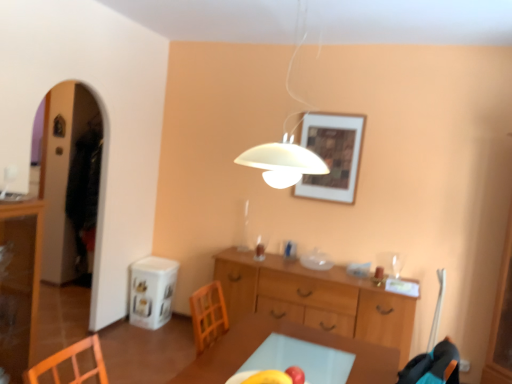
The height and width of the screenshot is (384, 512). What are the coordinates of `white matte lampshade at upper center` in the screenshot? It's located at (287, 135).

Measure the distance between point (323,145) and camera.

The depth of point (323,145) is 3.60 meters.

The width and height of the screenshot is (512, 384). What do you see at coordinates (332, 155) in the screenshot? I see `wooden framed artwork at upper center` at bounding box center [332, 155].

What is the approximate width of yellow matte apple at center?

It is 6.51 inches.

The image size is (512, 384). Describe the element at coordinates (315, 299) in the screenshot. I see `wooden cabinet at center` at that location.

Locate an element on the screen. The width and height of the screenshot is (512, 384). white matte lampshade at upper center is located at coordinates (287, 135).

Between white matte lampshade at upper center and light brown wooden table at center, which one has smaller size?

With smaller size is white matte lampshade at upper center.

Between white matte lampshade at upper center and light brown wooden table at center, which one appears on the left side from the viewer's perspective?

white matte lampshade at upper center is more to the left.

Measure the distance between white matte lampshade at upper center and light brown wooden table at center.

A distance of 6.52 feet exists between white matte lampshade at upper center and light brown wooden table at center.

Can you tell me how much white matte lampshade at upper center and light brown wooden table at center differ in facing direction?

white matte lampshade at upper center and light brown wooden table at center are facing 1.98 degrees away from each other.

Consider the image. Considering the positions of objects white matte lampshade at upper center and yellow matte apple at center in the image provided, who is behind, white matte lampshade at upper center or yellow matte apple at center?

yellow matte apple at center is more distant.

In the image, is white matte lampshade at upper center on the left side or the right side of yellow matte apple at center?

In the image, white matte lampshade at upper center appears on the right side of yellow matte apple at center.

Considering the sizes of objects white matte lampshade at upper center and yellow matte apple at center in the image provided, who is wider, white matte lampshade at upper center or yellow matte apple at center?

white matte lampshade at upper center is wider.

How different are the orientations of white matte lampshade at upper center and yellow matte apple at center in degrees?

The facing directions of white matte lampshade at upper center and yellow matte apple at center are 6.13e-05 degrees apart.

From a real-world perspective, is transparent glass cabinet at left positioned under wooden framed artwork at upper center based on gravity?

Yes, from a real-world perspective, transparent glass cabinet at left is below wooden framed artwork at upper center.

Is wooden framed artwork at upper center a part of transparent glass cabinet at left?

No, wooden framed artwork at upper center is not inside transparent glass cabinet at left.

Visually, is transparent glass cabinet at left positioned to the left or to the right of wooden framed artwork at upper center?

transparent glass cabinet at left is positioned on wooden framed artwork at upper center's left side.

Is transparent glass cabinet at left next to wooden framed artwork at upper center and touching it?

No, transparent glass cabinet at left is not beside wooden framed artwork at upper center.

Which of these two, wooden cabinet at center or yellow matte apple at center, is wider?

Wider between the two is wooden cabinet at center.

In the image, is wooden cabinet at center positioned in front of or behind yellow matte apple at center?

Clearly, wooden cabinet at center is behind yellow matte apple at center.

Is wooden cabinet at center to the left or to the right of yellow matte apple at center in the image?

In the image, wooden cabinet at center appears on the right side of yellow matte apple at center.

This screenshot has width=512, height=384. I want to click on desk behind the yellow matte apple at center, so click(x=315, y=299).

Measure the distance from light brown wooden table at center to wooden framed artwork at upper center.

They are 1.66 meters apart.

Is point (263, 329) closer to camera compared to point (332, 200)?

Yes, it is.

From a real-world perspective, between light brown wooden table at center and wooden framed artwork at upper center, who is vertically lower?

From a 3D spatial view, light brown wooden table at center is below.

In the scene shown: How many degrees apart are the facing directions of light brown wooden table at center and wooden framed artwork at upper center?

light brown wooden table at center and wooden framed artwork at upper center are facing 92 degrees away from each other.

Which of these two, transparent glass cabinet at left or light brown wooden table at center, is bigger?

Bigger between the two is light brown wooden table at center.

Does transparent glass cabinet at left appear on the left side of light brown wooden table at center?

Indeed, transparent glass cabinet at left is positioned on the left side of light brown wooden table at center.

From a real-world perspective, who is located lower, transparent glass cabinet at left or light brown wooden table at center?

In real-world perspective, light brown wooden table at center is lower.

In terms of height, does transparent glass cabinet at left look taller or shorter compared to light brown wooden table at center?

In the image, transparent glass cabinet at left appears to be taller than light brown wooden table at center.

Are wooden framed artwork at upper center and wooden cabinet at center beside each other?

No, wooden framed artwork at upper center is not making contact with wooden cabinet at center.

Between wooden framed artwork at upper center and wooden cabinet at center, which one has smaller size?

wooden framed artwork at upper center.

Is wooden framed artwork at upper center looking in the opposite direction of wooden cabinet at center?

wooden framed artwork at upper center is not turned away from wooden cabinet at center.

Does wooden framed artwork at upper center appear on the left side of wooden cabinet at center?

Incorrect, wooden framed artwork at upper center is not on the left side of wooden cabinet at center.

The width and height of the screenshot is (512, 384). I want to click on table on the right of the white matte lampshade at upper center, so click(290, 336).

Where is `fruit to the left of white matte lampshade at upper center`? fruit to the left of white matte lampshade at upper center is located at coordinates (277, 377).

From the image, which object appears to be nearer to wooden cabinet at center, light brown wooden table at center or white matte lampshade at upper center?

Based on the image, light brown wooden table at center appears to be nearer to wooden cabinet at center.

Estimate the real-world distances between objects in this image. Which object is further from wooden framed artwork at upper center, transparent glass cabinet at left or white matte lampshade at upper center?

transparent glass cabinet at left.

Based on the photo, from the image, which object appears to be farther from yellow matte apple at center, wooden framed artwork at upper center or transparent glass cabinet at left?

The object further to yellow matte apple at center is wooden framed artwork at upper center.

Considering their positions, is wooden cabinet at center positioned closer to light brown wooden table at center than yellow matte apple at center?

yellow matte apple at center lies closer to light brown wooden table at center than the other object.

Considering their positions, is yellow matte apple at center positioned further to white matte lampshade at upper center than transparent glass cabinet at left?

transparent glass cabinet at left is positioned further to the anchor white matte lampshade at upper center.

Looking at the image, which one is located closer to transparent glass cabinet at left, wooden framed artwork at upper center or light brown wooden table at center?

light brown wooden table at center is positioned closer to the anchor transparent glass cabinet at left.

When comparing their distances from wooden framed artwork at upper center, does transparent glass cabinet at left or yellow matte apple at center seem closer?

Based on the image, yellow matte apple at center appears to be nearer to wooden framed artwork at upper center.

Based on their spatial positions, is white matte lampshade at upper center or wooden cabinet at center further from transparent glass cabinet at left?

white matte lampshade at upper center lies further to transparent glass cabinet at left than the other object.

Identify the location of table between white matte lampshade at upper center and wooden framed artwork at upper center along the z-axis. Image resolution: width=512 pixels, height=384 pixels. (x=290, y=336).

Image resolution: width=512 pixels, height=384 pixels. Find the location of `fruit between transparent glass cabinet at left and white matte lampshade at upper center in the horizontal direction`. fruit between transparent glass cabinet at left and white matte lampshade at upper center in the horizontal direction is located at coordinates [277, 377].

You are a GUI agent. You are given a task and a screenshot of the screen. Output one action in this format:
    pyautogui.click(x=<x>, y=<y>)
    Task: Click on the desk between transparent glass cabinet at left and wooden framed artwork at upper center from left to right
    
    Given the screenshot: What is the action you would take?
    pyautogui.click(x=315, y=299)

This screenshot has width=512, height=384. Find the location of `fruit between transparent glass cabinet at left and wooden framed artwork at upper center from left to right`. fruit between transparent glass cabinet at left and wooden framed artwork at upper center from left to right is located at coordinates (277, 377).